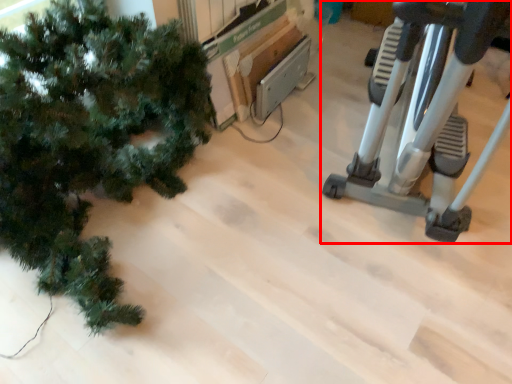
Question: From the image, what is the correct spatial relationship of stationary bicycle (annotated by the red box) in relation to christmas tree?

Choices:
 (A) right
 (B) left

Answer: (A)